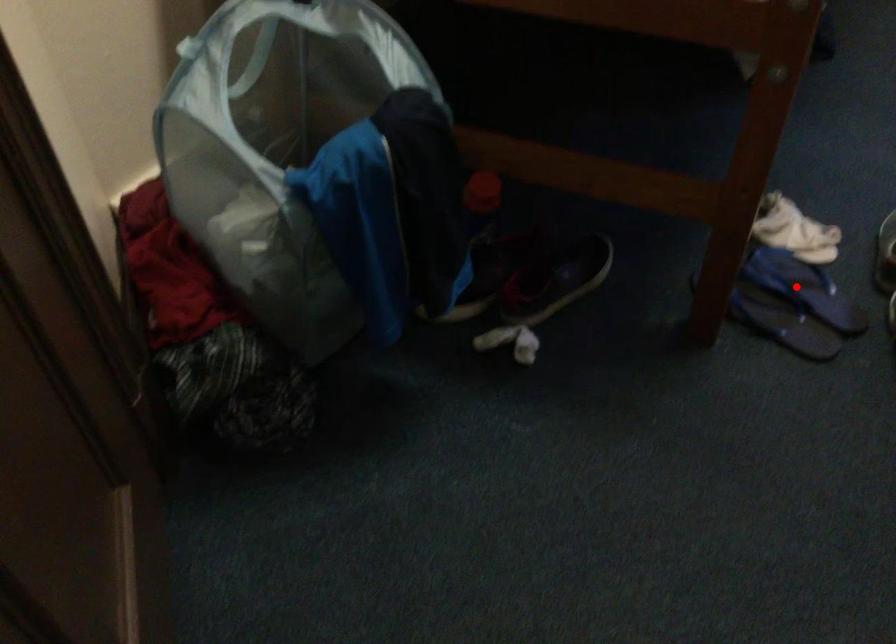
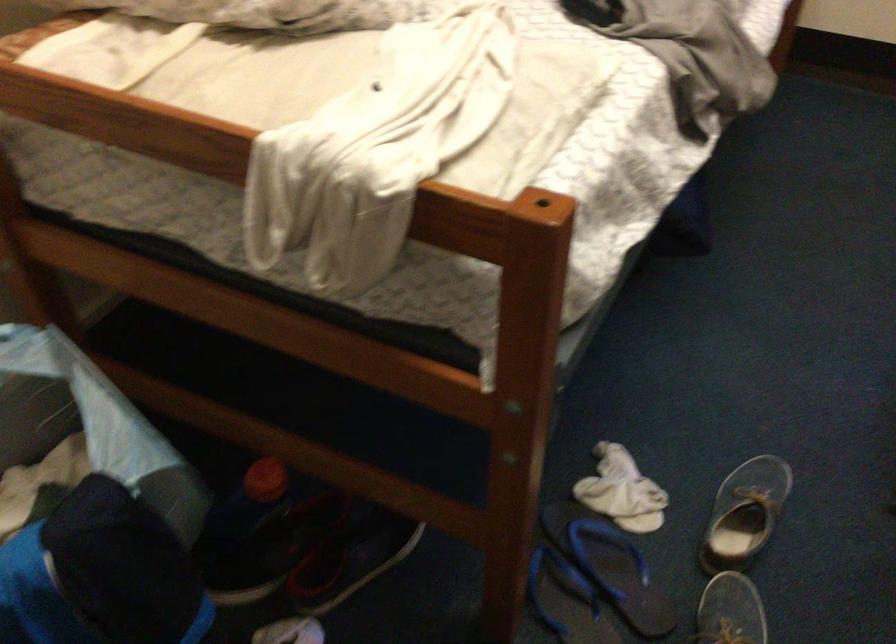
The point at the highlighted location is marked in the first image. Where is the corresponding point in the second image?

(609, 565)